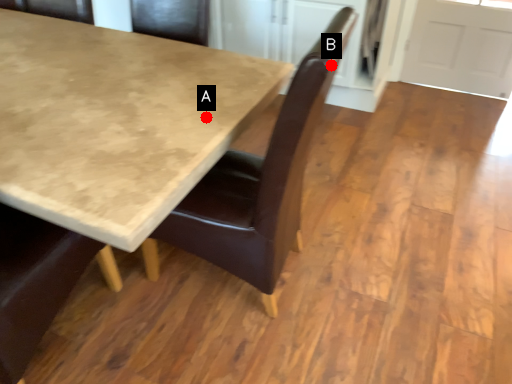
Question: Two points are circled on the image, labeled by A and B beside each circle. Which point is closer to the camera?

Choices:
 (A) A is closer
 (B) B is closer

Answer: (B)